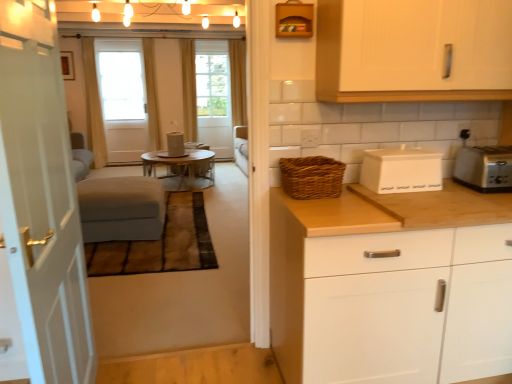
Question: Considering the relative sizes of white matte cabinet at right, the first cabinetry in the bottom-to-top sequence, and white wood cabinet at upper right, placed as the 2th cabinetry when sorted from bottom to top, in the image provided, is white matte cabinet at right, the first cabinetry in the bottom-to-top sequence, bigger than white wood cabinet at upper right, placed as the 2th cabinetry when sorted from bottom to top,?

Choices:
 (A) yes
 (B) no

Answer: (A)

Question: Considering the relative positions of white matte cabinet at right, the first cabinetry in the bottom-to-top sequence, and white wood cabinet at upper right, arranged as the first cabinetry when viewed from the top, in the image provided, is white matte cabinet at right, the first cabinetry in the bottom-to-top sequence, to the left of white wood cabinet at upper right, arranged as the first cabinetry when viewed from the top, from the viewer's perspective?

Choices:
 (A) yes
 (B) no

Answer: (B)

Question: Is white matte cabinet at right, the first cabinetry in the bottom-to-top sequence, smaller than white wood cabinet at upper right, placed as the 2th cabinetry when sorted from bottom to top?

Choices:
 (A) yes
 (B) no

Answer: (B)

Question: Are white matte cabinet at right, the first cabinetry in the bottom-to-top sequence, and white wood cabinet at upper right, arranged as the first cabinetry when viewed from the top, far apart?

Choices:
 (A) yes
 (B) no

Answer: (B)

Question: Considering the relative positions of white matte cabinet at right, the first cabinetry in the bottom-to-top sequence, and white wood cabinet at upper right, placed as the 2th cabinetry when sorted from bottom to top, in the image provided, is white matte cabinet at right, the first cabinetry in the bottom-to-top sequence, to the right of white wood cabinet at upper right, placed as the 2th cabinetry when sorted from bottom to top, from the viewer's perspective?

Choices:
 (A) no
 (B) yes

Answer: (B)

Question: Looking at their shapes, would you say white wooden door at left is wider or thinner than matte gray cylinder at center, the second appliance when ordered from bottom to top?

Choices:
 (A) wide
 (B) thin

Answer: (B)

Question: Considering the positions of point (29, 44) and point (174, 137), is point (29, 44) closer or farther from the camera than point (174, 137)?

Choices:
 (A) farther
 (B) closer

Answer: (B)

Question: Is white wooden door at left situated inside matte gray cylinder at center, the 1th appliance positioned from the left, or outside?

Choices:
 (A) outside
 (B) inside

Answer: (A)

Question: Considering the relative positions of white wooden door at left and matte gray cylinder at center, the second appliance when ordered from bottom to top, in the image provided, is white wooden door at left to the left or to the right of matte gray cylinder at center, the second appliance when ordered from bottom to top,?

Choices:
 (A) right
 (B) left

Answer: (A)

Question: Do you think suede-like gray couch at left is within velvet grey ottoman at center, or outside of it?

Choices:
 (A) outside
 (B) inside

Answer: (A)

Question: From a real-world perspective, is suede-like gray couch at left physically located above or below velvet grey ottoman at center?

Choices:
 (A) below
 (B) above

Answer: (B)

Question: Is suede-like gray couch at left bigger or smaller than velvet grey ottoman at center?

Choices:
 (A) big
 (B) small

Answer: (A)

Question: Does point (132, 226) appear closer or farther from the camera than point (206, 241)?

Choices:
 (A) farther
 (B) closer

Answer: (A)

Question: In terms of width, does suede-like gray couch at left look wider or thinner when compared to white matte bread box at upper right, the second appliance positioned from the back?

Choices:
 (A) thin
 (B) wide

Answer: (B)

Question: Considering the positions of suede-like gray couch at left and white matte bread box at upper right, the second appliance positioned from the back, in the image, is suede-like gray couch at left taller or shorter than white matte bread box at upper right, the second appliance positioned from the back,?

Choices:
 (A) short
 (B) tall

Answer: (B)